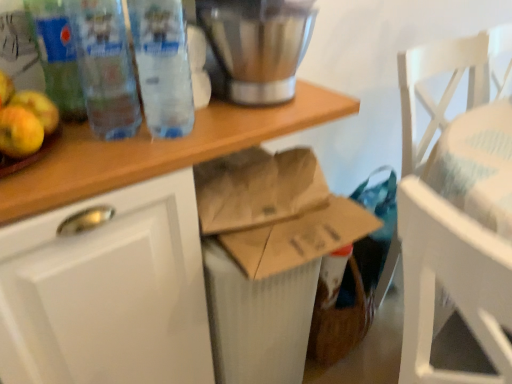
At what (x,y) coordinates should I click in order to perform the action: click on vacant point to the left of transparent plastic bottles at upper left, arranged as the 1th bottle when viewed from the right. Please return your answer as a coordinate pair (x, y). The height and width of the screenshot is (384, 512). Looking at the image, I should click on (111, 139).